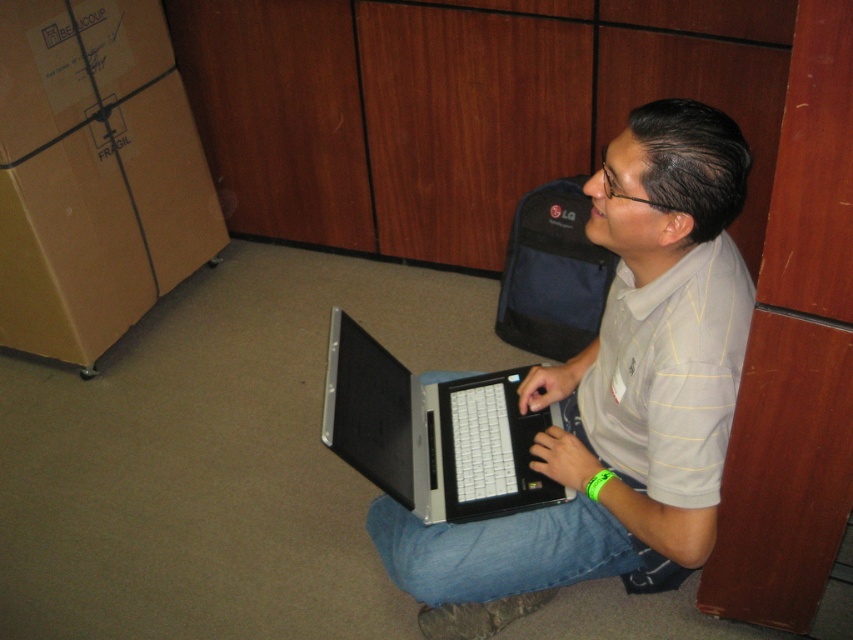
You are trying to decide which laptop to use for a long coding session. You have both the gray matte laptop at center and the silver metallic laptop at center available. Considering their sizes, which one might be more comfortable for extended use?

The gray matte laptop at center has a larger width than the silver metallic laptop at center, so it might provide more screen space and comfort for a long coding session.

You are a delivery person who needs to place a small package on the floor near the man without disturbing him. The package must be placed at point (616, 394). What object is located at that point?

The gray matte laptop at center is located at point (616, 394).